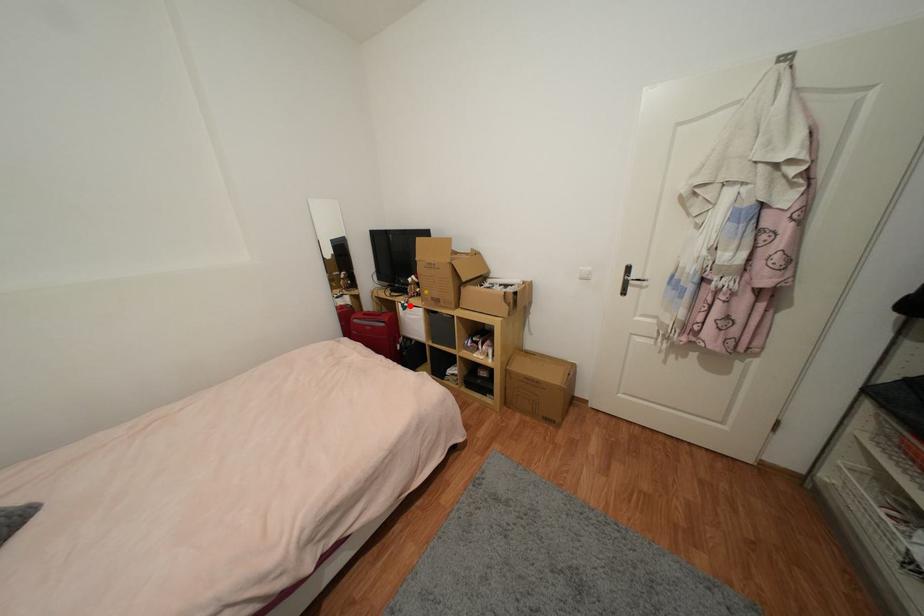
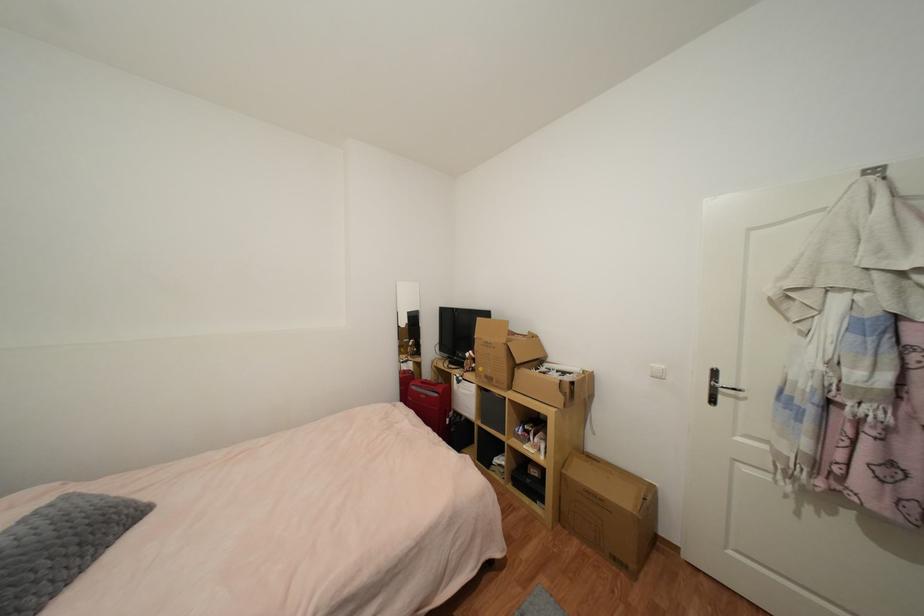
Question: I am providing you with two images of the same scene from different viewpoints. Image1 has a red point marked. In image2, the corresponding 3D location appears at what relative position? Reply with the corresponding letter.

Choices:
 (A) Closer
 (B) Farther

Answer: (B)